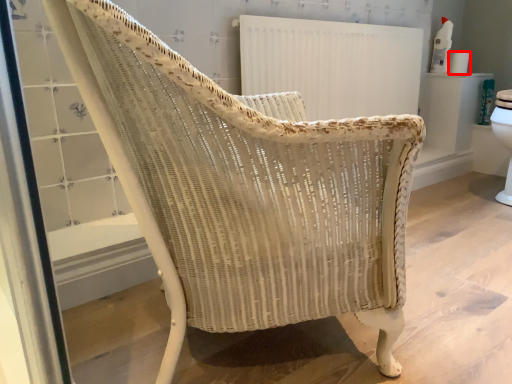
Question: Observing the image, what is the correct spatial positioning of toilet paper (annotated by the red box) in reference to radiator?

Choices:
 (A) right
 (B) left

Answer: (A)